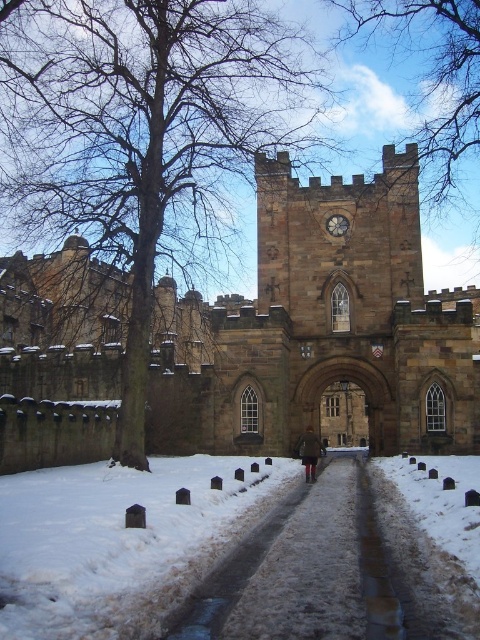
Who is positioned more to the left, brown leafless tree at center or bare branches at upper center?

Positioned to the left is brown leafless tree at center.

Is brown leafless tree at center positioned behind bare branches at upper center?

No, it is in front of bare branches at upper center.

Which is behind, point (98, 204) or point (448, 166)?

The point (448, 166) is more distant.

Find the location of `brown leafless tree at center`. brown leafless tree at center is located at coordinates (140, 129).